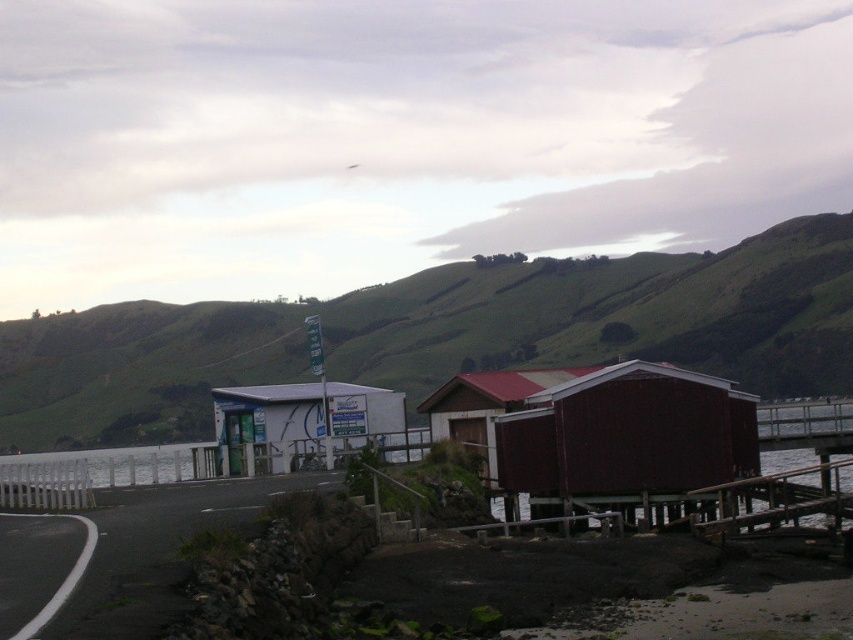
The width and height of the screenshot is (853, 640). Describe the element at coordinates (300, 419) in the screenshot. I see `white plastic building at center` at that location.

Measure the distance from white plastic building at center to wooden cabin at center.

The distance of white plastic building at center from wooden cabin at center is 5.34 meters.

The image size is (853, 640). What do you see at coordinates (300, 419) in the screenshot?
I see `white plastic building at center` at bounding box center [300, 419].

Locate an element on the screen. This screenshot has width=853, height=640. white plastic building at center is located at coordinates (300, 419).

Who is taller, dark red wood cabin at center or wooden cabin at center?

dark red wood cabin at center is taller.

Can you confirm if dark red wood cabin at center is positioned below wooden cabin at center?

Yes, dark red wood cabin at center is below wooden cabin at center.

Identify the location of dark red wood cabin at center. The height and width of the screenshot is (640, 853). (625, 436).

From the picture: Is dark red wood cabin at center positioned before white plastic building at center?

That is True.

Is dark red wood cabin at center to the right of white plastic building at center from the viewer's perspective?

Correct, you'll find dark red wood cabin at center to the right of white plastic building at center.

What do you see at coordinates (625, 436) in the screenshot? I see `dark red wood cabin at center` at bounding box center [625, 436].

I want to click on dark red wood cabin at center, so click(x=625, y=436).